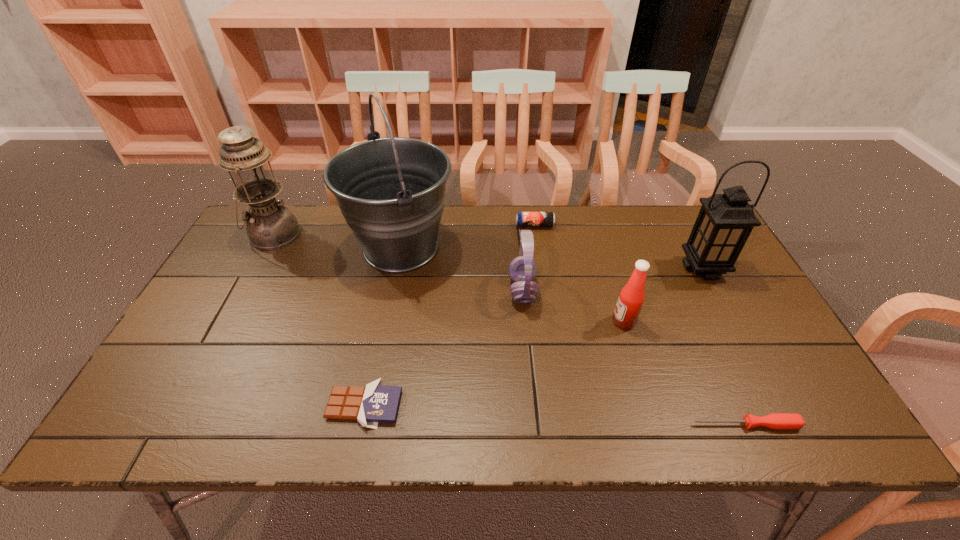
You are a GUI agent. You are given a task and a screenshot of the screen. Output one action in this format:
    pyautogui.click(x=<x>, y=<y>)
    Task: Click on the vacant space located 0.180m at the tip of the screwdriver
    The width and height of the screenshot is (960, 540).
    Given the screenshot: What is the action you would take?
    pyautogui.click(x=609, y=424)

Locate an element on the screen. vacant space located on the left of the chocolate bar is located at coordinates tap(161, 406).

Where is `bucket at the far edge`? Image resolution: width=960 pixels, height=540 pixels. bucket at the far edge is located at coordinates (391, 191).

In order to click on oil lamp located at the far edge in this screenshot , I will do `click(270, 225)`.

Locate an element on the screen. beer can at the far edge is located at coordinates (523, 219).

Identify the location of screwdriver that is positioned at the near edge. The height and width of the screenshot is (540, 960). (782, 421).

The height and width of the screenshot is (540, 960). I want to click on chocolate bar that is at the near edge, so click(374, 403).

Locate an element on the screen. This screenshot has width=960, height=540. object that is at the left edge is located at coordinates (270, 225).

Where is `lantern situated at the right edge`? This screenshot has height=540, width=960. lantern situated at the right edge is located at coordinates (725, 221).

You are a GUI agent. You are given a task and a screenshot of the screen. Output one action in this format:
    pyautogui.click(x=<x>, y=<y>)
    Task: Click on the screwdriver present at the right edge
    Image resolution: width=960 pixels, height=540 pixels.
    Given the screenshot: What is the action you would take?
    pyautogui.click(x=782, y=421)